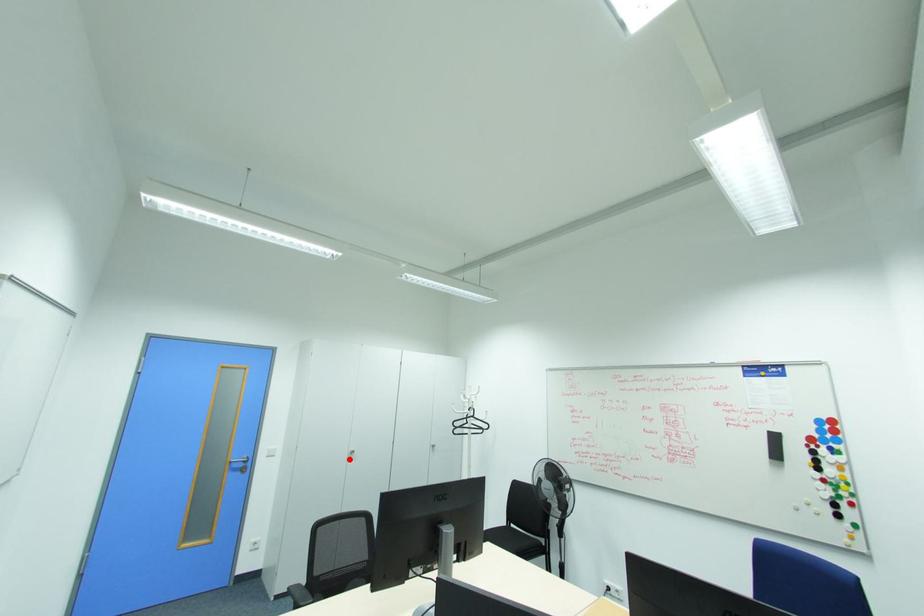
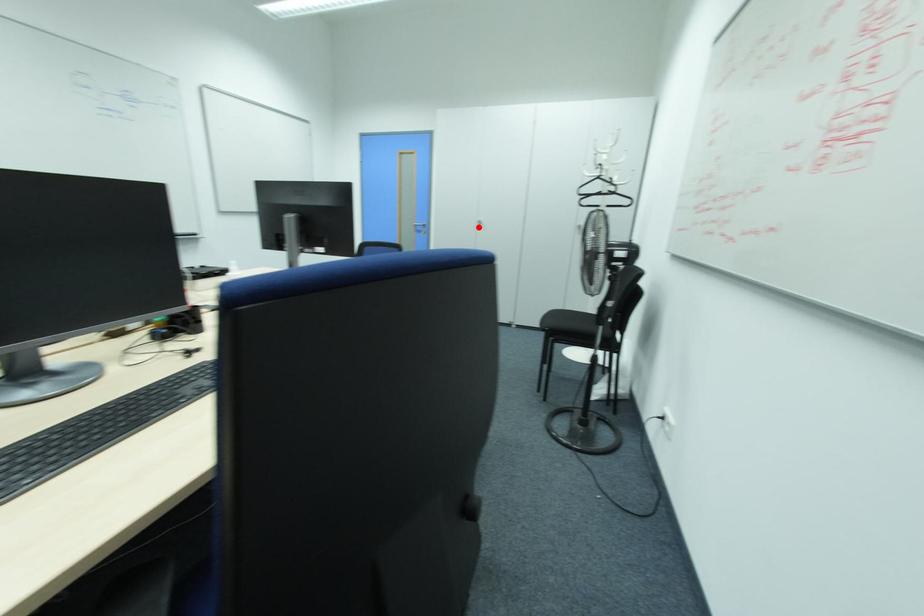
I am providing you with two images of the same scene from different viewpoints. A red point is marked on the first image and another point is marked on the second image. Does the point marked in image1 correspond to the same location as the one in image2?

Yes